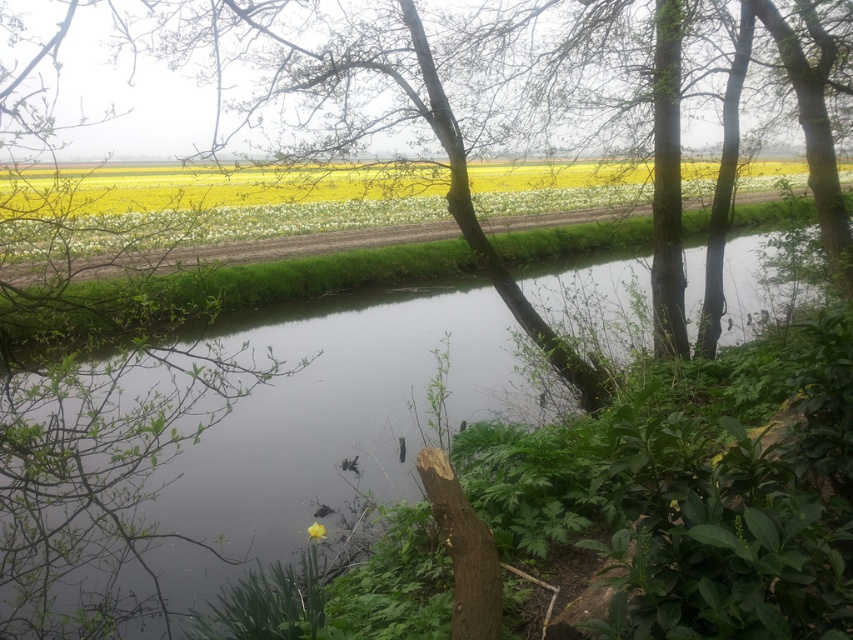
Question: Is yellow matte flowers at upper center thinner than yellow matte flower at center?

Choices:
 (A) no
 (B) yes

Answer: (A)

Question: Which point is closer to the camera?

Choices:
 (A) (172, 237)
 (B) (759, 529)
 (C) (312, 531)

Answer: (B)

Question: Which object is the farthest from the clear water at center?

Choices:
 (A) yellow matte flowers at upper center
 (B) yellow matte flower at center

Answer: (A)

Question: Among these objects, which one is nearest to the camera?

Choices:
 (A) yellow matte flowers at upper center
 (B) clear water at center

Answer: (B)

Question: Where is clear water at center located in relation to yellow matte flower at center in the image?

Choices:
 (A) below
 (B) above

Answer: (B)

Question: Can you confirm if yellow matte flowers at upper center is wider than yellow matte flower at center?

Choices:
 (A) no
 (B) yes

Answer: (B)